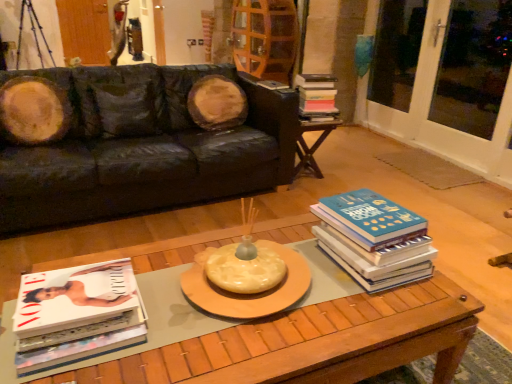
Locate an element on the screen. vacant space situated above blue hardcover book at right, the 2th book in the front-to-back sequence (from a real-world perspective) is located at coordinates (372, 213).